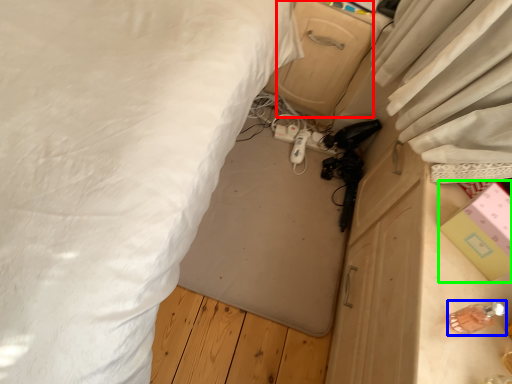
Question: Which object is positioned farthest from drawer (highlighted by a red box)? Select from equipment (highlighted by a blue box) and box (highlighted by a green box).

Choices:
 (A) equipment
 (B) box

Answer: (A)